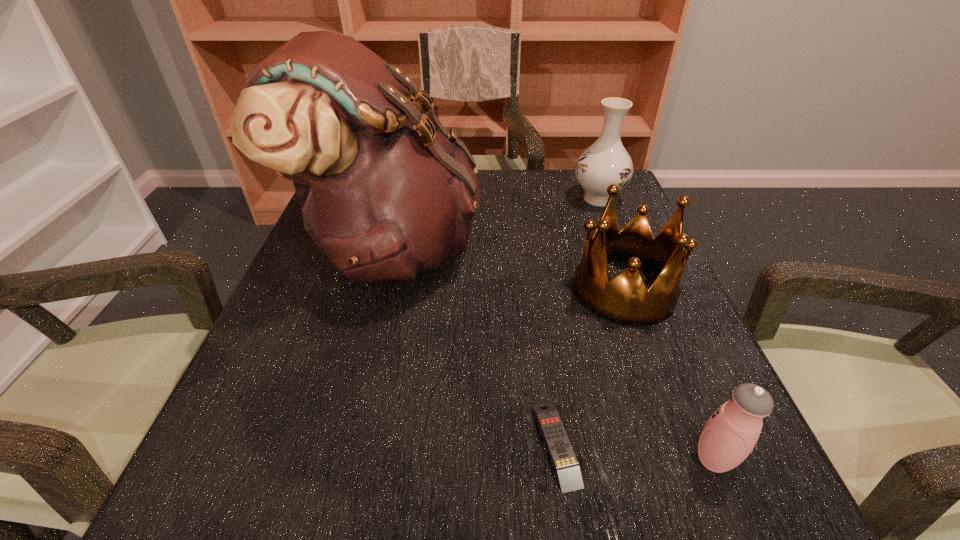
Where is `object at the far left corner`? object at the far left corner is located at coordinates (386, 193).

The image size is (960, 540). I want to click on object that is at the far right corner, so click(x=606, y=161).

Find the location of a particular element. object that is at the near right corner is located at coordinates (730, 434).

In the image, there is a desktop. At what (x,y) coordinates should I click in order to perform the action: click on vacant space at the far edge. Please return your answer as a coordinate pair (x, y). Image resolution: width=960 pixels, height=540 pixels. Looking at the image, I should click on (510, 212).

Identify the location of free space at the near edge of the desktop. (362, 469).

Where is `free space at the left edge of the desktop`? free space at the left edge of the desktop is located at coordinates (301, 256).

At what (x,y) coordinates should I click in order to perform the action: click on vacant space at the right edge of the desktop. Please return your answer as a coordinate pair (x, y). The image size is (960, 540). Looking at the image, I should click on (684, 340).

In the image, there is a desktop. Identify the location of blank space at the near right corner. (737, 502).

This screenshot has height=540, width=960. Find the location of `free spot between the fourth object from right to left and the second tallest object`. free spot between the fourth object from right to left and the second tallest object is located at coordinates (577, 321).

Locate an element on the screen. The width and height of the screenshot is (960, 540). free point between the second shortest object and the leftmost object is located at coordinates (553, 354).